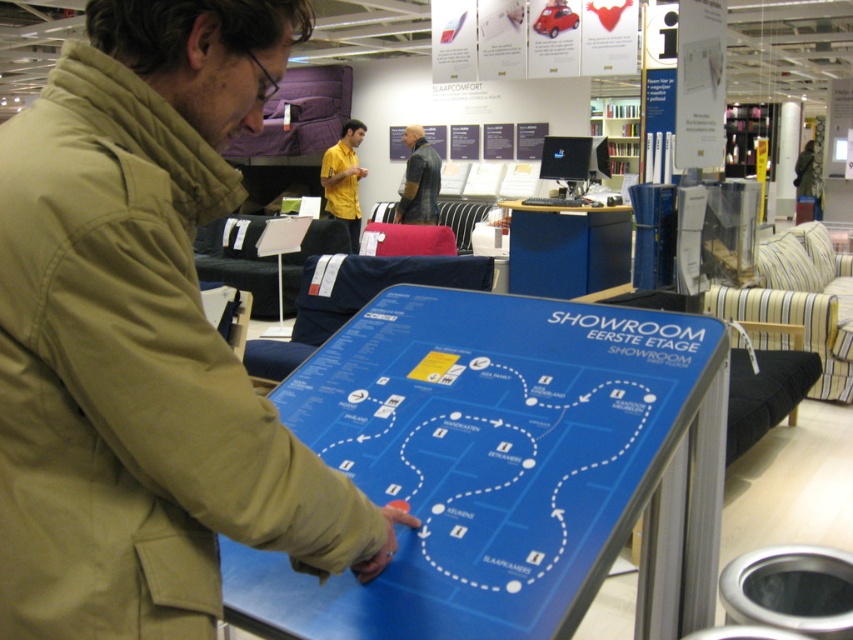
You are a customer in a furniture store and you need to locate the interactive map. You see the blue glossy map at center and the blue laminate desk at center. Which object is taller?

The blue glossy map at center is much taller than the blue laminate desk at center.

You are standing at point (x=425, y=140) and want to move towards point (x=341, y=177). Which direction should you move?

You should move towards the direction of point (x=341, y=177), which is behind point (x=425, y=140).

You are a store employee and you need to determine which customer has a larger top. You see a yellow matte shirt at center and a leather jacket at center. Which one has a bigger top?

The yellow matte shirt at center has a larger size compared to the leather jacket at center, so the customer wearing the yellow matte shirt at center has the bigger top.